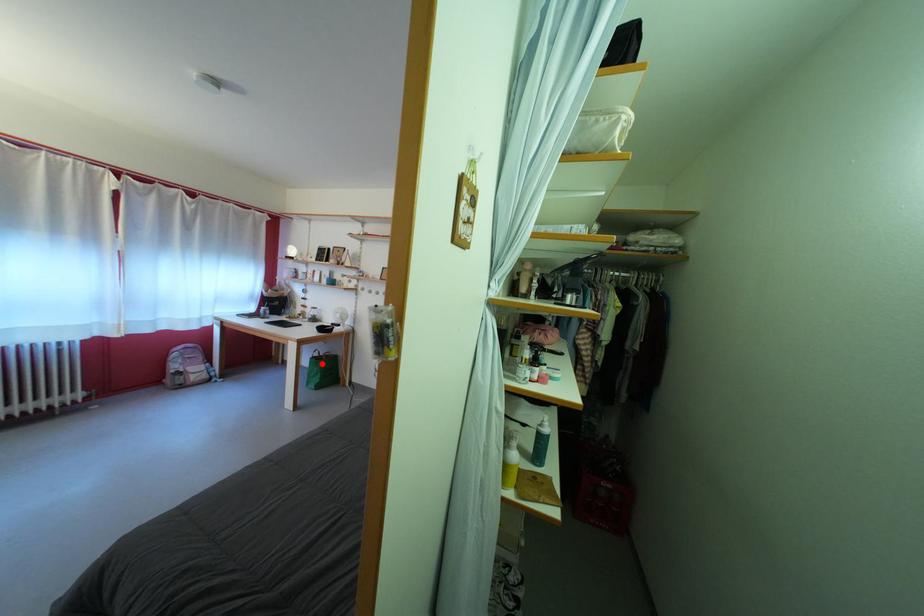
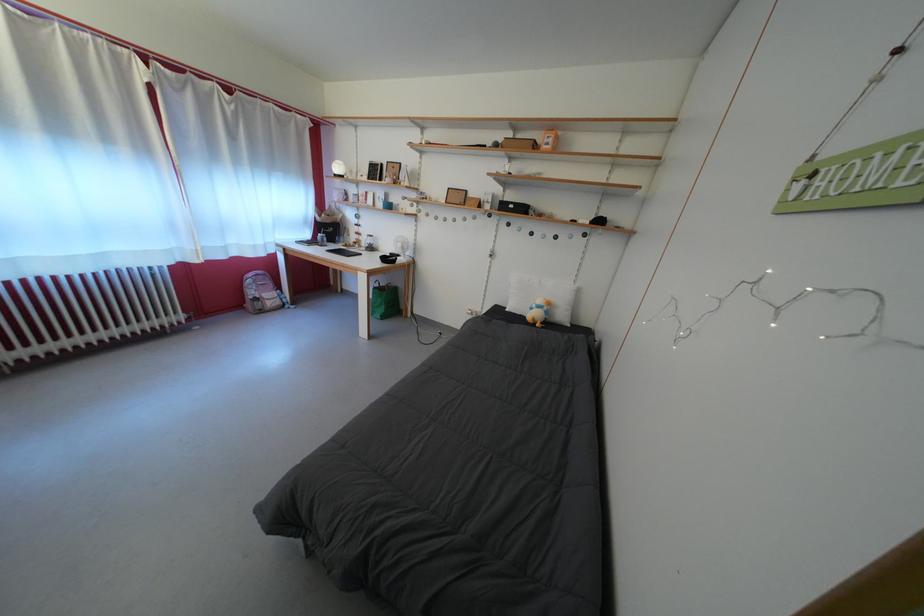
Question: A red point is marked in image1. In image2, is the corresponding 3D point closer to the camera or farther? Reply with the corresponding letter.

Choices:
 (A) The corresponding 3D point is closer.
 (B) The corresponding 3D point is farther.

Answer: (A)